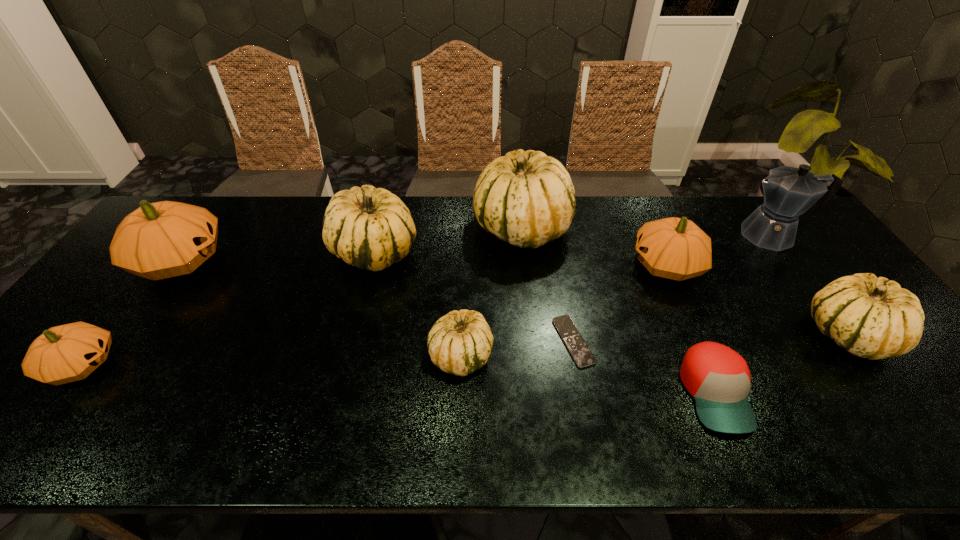
Identify which gourd is located as the fourth nearest to the smallest white gourd. Please provide its 2D coordinates. Your answer should be formatted as a tuple, i.e. [(x, y)], where the tuple contains the x and y coordinates of a point satisfying the conditions above.

[(161, 240)]

Identify the location of the third closest white gourd to the rightmost gourd. (369, 228).

Select which white gourd appears as the second closest to the third biggest white gourd. Please provide its 2D coordinates. Your answer should be formatted as a tuple, i.e. [(x, y)], where the tuple contains the x and y coordinates of a point satisfying the conditions above.

[(459, 343)]

You are a GUI agent. You are given a task and a screenshot of the screen. Output one action in this format:
    pyautogui.click(x=<x>, y=<y>)
    Task: Click on the orange gourd identified as the second closest to the smallest white gourd
    The width and height of the screenshot is (960, 540).
    Given the screenshot: What is the action you would take?
    pyautogui.click(x=161, y=240)

Point out which orange gourd is positioned as the third nearest to the leftmost white gourd. Please provide its 2D coordinates. Your answer should be formatted as a tuple, i.e. [(x, y)], where the tuple contains the x and y coordinates of a point satisfying the conditions above.

[(675, 248)]

I want to click on vacant space that satisfies the following two spatial constraints: 1. on the back side of the fifth gourd from right to left; 2. on the left side of the biggest white gourd, so click(x=381, y=227).

Locate an element on the screen. vacant region that satisfies the following two spatial constraints: 1. on the front side of the remote control; 2. on the right side of the leftmost white gourd is located at coordinates (352, 341).

Where is `vacant space that satisfies the following two spatial constraints: 1. on the back side of the biggest white gourd; 2. on the right side of the leftmost white gourd`? The width and height of the screenshot is (960, 540). vacant space that satisfies the following two spatial constraints: 1. on the back side of the biggest white gourd; 2. on the right side of the leftmost white gourd is located at coordinates (381, 227).

This screenshot has height=540, width=960. Identify the location of vacant space that satisfies the following two spatial constraints: 1. on the side of the second smallest orange gourd with the carved face; 2. on the right side of the rightmost white gourd. (697, 334).